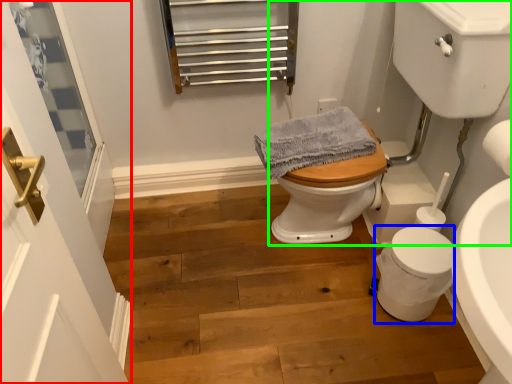
Question: Considering the real-world distances, which object is closest to screen door (highlighted by a red box)? porcelain (highlighted by a blue box) or sink (highlighted by a green box).

Choices:
 (A) porcelain
 (B) sink

Answer: (A)